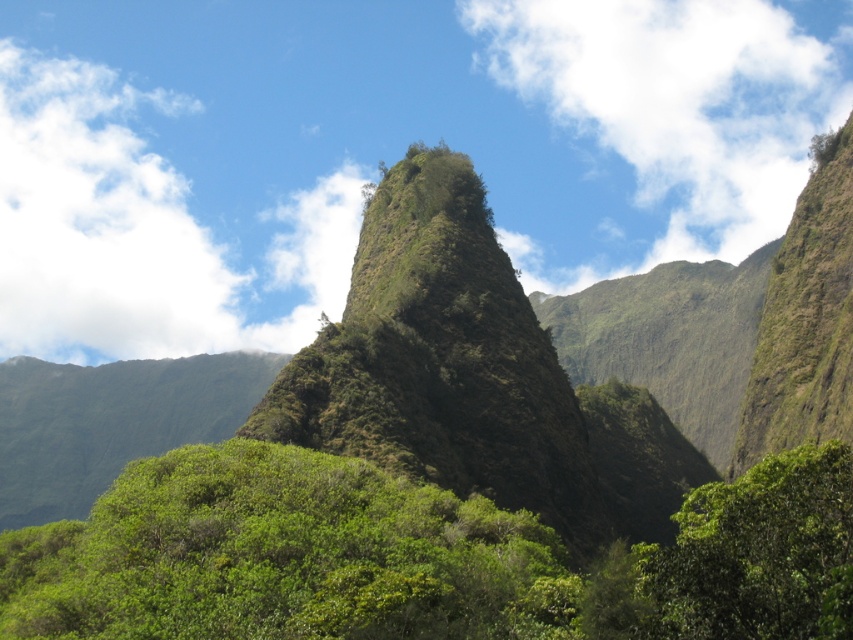
Question: Does green leafy tree at center have a larger size compared to green leafy tree at lower right?

Choices:
 (A) no
 (B) yes

Answer: (B)

Question: Which object is the closest to the green rocky mountain at center?

Choices:
 (A) green leafy tree at lower right
 (B) green leafy tree at center

Answer: (B)

Question: Which object is positioned closest to the green leafy tree at center?

Choices:
 (A) green leafy tree at lower right
 (B) green rocky mountain at center

Answer: (A)

Question: Is green leafy tree at center positioned before green leafy tree at lower right?

Choices:
 (A) yes
 (B) no

Answer: (B)

Question: Which of the following is the closest to the observer?

Choices:
 (A) (584, 618)
 (B) (730, 580)

Answer: (B)

Question: Is green leafy tree at center thinner than green leafy tree at lower right?

Choices:
 (A) yes
 (B) no

Answer: (B)